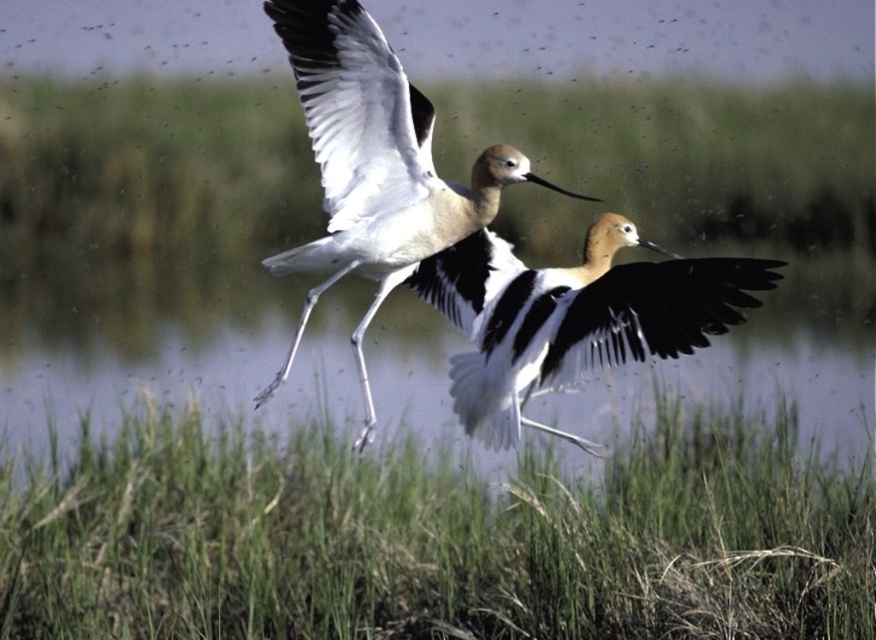
Question: Which point is closer to the camera?

Choices:
 (A) black and white feathers at center
 (B) white feathered bird at center
 (C) green grass at center
 (D) clear water at center

Answer: (D)

Question: Among these objects, which one is nearest to the camera?

Choices:
 (A) clear water at center
 (B) green grass at center
 (C) black and white feathers at center
 (D) white feathered bird at center

Answer: (A)

Question: Can you confirm if clear water at center is thinner than black and white feathers at center?

Choices:
 (A) yes
 (B) no

Answer: (B)

Question: Which point is closer to the camera?

Choices:
 (A) (290, 520)
 (B) (470, 104)

Answer: (A)

Question: Does black and white feathers at center have a larger size compared to white feathered bird at center?

Choices:
 (A) no
 (B) yes

Answer: (B)

Question: Is clear water at center in front of white feathered bird at center?

Choices:
 (A) no
 (B) yes

Answer: (B)